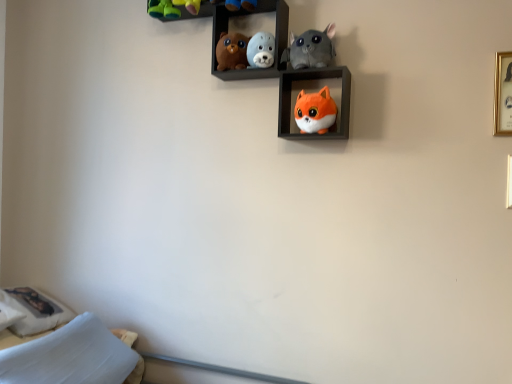
In order to face rubber duckies at upper center, should I rotate leftwards or rightwards?

It's best to rotate left around 9.148 degrees.

Find the location of `rubber duckies at upper center`. rubber duckies at upper center is located at coordinates (176, 10).

At what (x,y) coordinates should I click in order to perform the action: click on white soft pillow at lower left, the 2th pillow from the left. Please return your answer as a coordinate pair (x, y). Looking at the image, I should click on (70, 356).

Measure the distance between point (91, 373) and camera.

Point (91, 373) and camera are 5.20 feet apart from each other.

Where is `soft gray plush cat at upper center, positioned as the 2th toy in right-to-left order`? soft gray plush cat at upper center, positioned as the 2th toy in right-to-left order is located at coordinates (311, 48).

Can you confirm if rubber duckies at upper center is bigger than gold metallic picture frame at upper right?

Indeed, rubber duckies at upper center has a larger size compared to gold metallic picture frame at upper right.

Can you tell me how much rubber duckies at upper center and gold metallic picture frame at upper right differ in facing direction?

The facing directions of rubber duckies at upper center and gold metallic picture frame at upper right are 0.321 degrees apart.

From a real-world perspective, is rubber duckies at upper center over gold metallic picture frame at upper right?

Yes, from a real-world perspective, rubber duckies at upper center is on top of gold metallic picture frame at upper right.

Could you tell me if rubber duckies at upper center is turned towards gold metallic picture frame at upper right?

No, rubber duckies at upper center is not turned towards gold metallic picture frame at upper right.

Is white soft pillow at lower left, the 2th pillow from the left, positioned with its back to velvety plush toys at upper center, the first shelf when ordered from left to right?

No, white soft pillow at lower left, the 2th pillow from the left, is not facing the opposite direction of velvety plush toys at upper center, the first shelf when ordered from left to right.

Who is smaller, white soft pillow at lower left, the 2th pillow from the left, or velvety plush toys at upper center, the first shelf when ordered from left to right?

velvety plush toys at upper center, the first shelf when ordered from left to right, is smaller.

Considering the sizes of white soft pillow at lower left, the 1th pillow from the right, and velvety plush toys at upper center, which appears as the 2th shelf when ordered from the bottom, in the image, is white soft pillow at lower left, the 1th pillow from the right, wider or thinner than velvety plush toys at upper center, which appears as the 2th shelf when ordered from the bottom,?

In the image, white soft pillow at lower left, the 1th pillow from the right, appears to be wider than velvety plush toys at upper center, which appears as the 2th shelf when ordered from the bottom.

From a real-world perspective, does white soft pillow at lower left, the 1th pillow from the right, sit lower than velvety plush toys at upper center, marked as the 1th shelf in a top-to-bottom arrangement?

Yes, from a real-world perspective, white soft pillow at lower left, the 1th pillow from the right, is below velvety plush toys at upper center, marked as the 1th shelf in a top-to-bottom arrangement.

Is rubber duckies at upper center touching orange plush toy at center, the first shelf positioned from the right?

rubber duckies at upper center and orange plush toy at center, the first shelf positioned from the right, are not in contact.

Is rubber duckies at upper center facing away from orange plush toy at center, arranged as the 2th shelf when viewed from the top?

rubber duckies at upper center is not turned away from orange plush toy at center, arranged as the 2th shelf when viewed from the top.

Does rubber duckies at upper center have a smaller size compared to orange plush toy at center, which ranks as the second shelf in left-to-right order?

Yes, rubber duckies at upper center is smaller than orange plush toy at center, which ranks as the second shelf in left-to-right order.

Is rubber duckies at upper center located within white soft pillow at lower left, the 1th pillow from the right?

No, rubber duckies at upper center is located outside of white soft pillow at lower left, the 1th pillow from the right.

Considering the sizes of objects white soft pillow at lower left, the 1th pillow from the right, and rubber duckies at upper center in the image provided, who is shorter, white soft pillow at lower left, the 1th pillow from the right, or rubber duckies at upper center?

rubber duckies at upper center is shorter.

Consider the image. Can you confirm if white soft pillow at lower left, the 2th pillow from the left, is thinner than rubber duckies at upper center?

No, white soft pillow at lower left, the 2th pillow from the left, is not thinner than rubber duckies at upper center.

In terms of size, does white soft pillow at lower left, the 1th pillow from the right, appear bigger or smaller than rubber duckies at upper center?

In the image, white soft pillow at lower left, the 1th pillow from the right, appears to be larger than rubber duckies at upper center.

Would you say matte brown plush bear at upper center, positioned as the first toy in left-to-right order, is a long distance from velvety plush toys at upper center, which appears as the 2th shelf when ordered from the bottom?

No, matte brown plush bear at upper center, positioned as the first toy in left-to-right order, is not far from velvety plush toys at upper center, which appears as the 2th shelf when ordered from the bottom.

In order to click on shelf above the matte brown plush bear at upper center, positioned as the first toy in left-to-right order (from the image's perspective) in this screenshot , I will do `click(245, 17)`.

Is matte brown plush bear at upper center, marked as the 4th toy in a right-to-left arrangement, completely or partially outside of velvety plush toys at upper center, the first shelf when ordered from left to right?

No, matte brown plush bear at upper center, marked as the 4th toy in a right-to-left arrangement, is inside velvety plush toys at upper center, the first shelf when ordered from left to right,'s boundary.

Considering the sizes of objects matte brown plush bear at upper center, marked as the 4th toy in a right-to-left arrangement, and velvety plush toys at upper center, the first shelf when ordered from left to right, in the image provided, who is taller, matte brown plush bear at upper center, marked as the 4th toy in a right-to-left arrangement, or velvety plush toys at upper center, the first shelf when ordered from left to right,?

velvety plush toys at upper center, the first shelf when ordered from left to right, is taller.

Which is in front, orange plush toy at center, which ranks as the second shelf in left-to-right order, or rubber duckies at upper center?

orange plush toy at center, which ranks as the second shelf in left-to-right order, is closer to the camera.

From a real-world perspective, which object stands above the other?

rubber duckies at upper center is physically above.

Is orange plush toy at center, the first shelf from the bottom, outside of rubber duckies at upper center?

Yes, orange plush toy at center, the first shelf from the bottom, is located beyond the bounds of rubber duckies at upper center.

Is point (329, 110) positioned in front of point (105, 349)?

Yes.

From a real-world perspective, is orange plush fox at center, the fourth toy viewed from the left, positioned above or below white soft pillow at lower left, the 1th pillow from the right?

Clearly, from a real-world perspective, orange plush fox at center, the fourth toy viewed from the left, is above white soft pillow at lower left, the 1th pillow from the right.

Measure the distance between orange plush fox at center, the first toy positioned from the right, and white soft pillow at lower left, the 2th pillow from the left.

orange plush fox at center, the first toy positioned from the right, is 1.20 meters from white soft pillow at lower left, the 2th pillow from the left.

Considering the relative sizes of orange plush fox at center, the fourth toy viewed from the left, and white soft pillow at lower left, the 2th pillow from the left, in the image provided, is orange plush fox at center, the fourth toy viewed from the left, taller than white soft pillow at lower left, the 2th pillow from the left,?

No.

This screenshot has height=384, width=512. What are the coordinates of `cabinet that appears above the gold metallic picture frame at upper right (from a real-world perspective)` in the screenshot? It's located at pyautogui.click(x=176, y=10).

This screenshot has width=512, height=384. There is a white soft pillow at lower left, the 1th pillow from the right. What are the coordinates of `the 2nd shelf above it (from the image's perspective)` in the screenshot? It's located at (245, 17).

Considering their positions, is soft plush seal at upper center, which appears as the third toy when viewed from the right, positioned further to white soft pillow at lower left, arranged as the 2th pillow when viewed from the right, than rubber duckies at upper center?

soft plush seal at upper center, which appears as the third toy when viewed from the right, is further to white soft pillow at lower left, arranged as the 2th pillow when viewed from the right.

Which object lies nearer to the anchor point soft plush seal at upper center, which appears as the third toy when viewed from the right, matte brown plush bear at upper center, positioned as the first toy in left-to-right order, or rubber duckies at upper center?

matte brown plush bear at upper center, positioned as the first toy in left-to-right order, lies closer to soft plush seal at upper center, which appears as the third toy when viewed from the right, than the other object.

When comparing their distances from matte brown plush bear at upper center, positioned as the first toy in left-to-right order, does white soft pillow at lower left, the 1th pillow from the right, or orange plush toy at center, the first shelf positioned from the right, seem closer?

orange plush toy at center, the first shelf positioned from the right, lies closer to matte brown plush bear at upper center, positioned as the first toy in left-to-right order, than the other object.

Based on their spatial positions, is orange plush toy at center, the first shelf from the bottom, or white soft pillow at lower left, the 2th pillow from the left, further from matte brown plush bear at upper center, positioned as the first toy in left-to-right order?

white soft pillow at lower left, the 2th pillow from the left, is further to matte brown plush bear at upper center, positioned as the first toy in left-to-right order.

Which object lies further to the anchor point soft gray plush cat at upper center, which ranks as the 3th toy in left-to-right order, gold metallic picture frame at upper right or soft plush seal at upper center, which appears as the third toy when viewed from the right?

Based on the image, gold metallic picture frame at upper right appears to be further to soft gray plush cat at upper center, which ranks as the 3th toy in left-to-right order.

Which object lies nearer to the anchor point velvety plush toys at upper center, which appears as the 2th shelf when viewed from the right, white soft pillow at lower left, the 1th pillow in the left-to-right sequence, or gold metallic picture frame at upper right?

gold metallic picture frame at upper right is closer to velvety plush toys at upper center, which appears as the 2th shelf when viewed from the right.

From the image, which object appears to be farther from white soft pillow at lower left, the 1th pillow in the left-to-right sequence, matte brown plush bear at upper center, marked as the 4th toy in a right-to-left arrangement, or soft gray plush cat at upper center, positioned as the 2th toy in right-to-left order?

Among the two, soft gray plush cat at upper center, positioned as the 2th toy in right-to-left order, is located further to white soft pillow at lower left, the 1th pillow in the left-to-right sequence.

Based on their spatial positions, is velvety plush toys at upper center, which appears as the 2th shelf when viewed from the right, or orange plush toy at center, the first shelf from the bottom, further from orange plush fox at center, the first toy positioned from the right?

Based on the image, velvety plush toys at upper center, which appears as the 2th shelf when viewed from the right, appears to be further to orange plush fox at center, the first toy positioned from the right.

Where is `shelf situated between rubber duckies at upper center and soft gray plush cat at upper center, positioned as the 2th toy in right-to-left order, from left to right`? This screenshot has width=512, height=384. shelf situated between rubber duckies at upper center and soft gray plush cat at upper center, positioned as the 2th toy in right-to-left order, from left to right is located at coordinates (245, 17).

Where is `shelf situated between white soft pillow at lower left, the 1th pillow in the left-to-right sequence, and orange plush toy at center, arranged as the 2th shelf when viewed from the top, from left to right`? The image size is (512, 384). shelf situated between white soft pillow at lower left, the 1th pillow in the left-to-right sequence, and orange plush toy at center, arranged as the 2th shelf when viewed from the top, from left to right is located at coordinates (245, 17).

Identify the location of toy between rubber duckies at upper center and soft plush seal at upper center, which is the 2th toy from left to right, in the horizontal direction. This screenshot has width=512, height=384. (231, 51).

Find the location of a particular element. This screenshot has height=384, width=512. toy situated between matte brown plush bear at upper center, marked as the 4th toy in a right-to-left arrangement, and soft gray plush cat at upper center, positioned as the 2th toy in right-to-left order, from left to right is located at coordinates (261, 50).